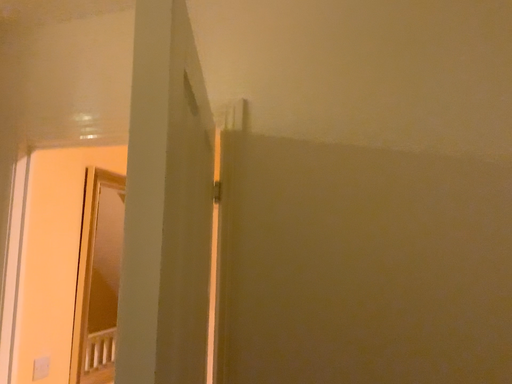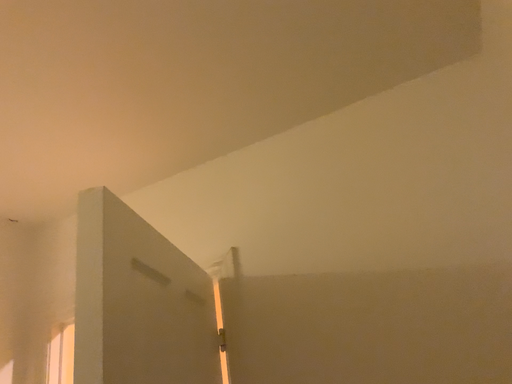
Question: Which way did the camera rotate in the video?

Choices:
 (A) rotated right
 (B) rotated left

Answer: (B)